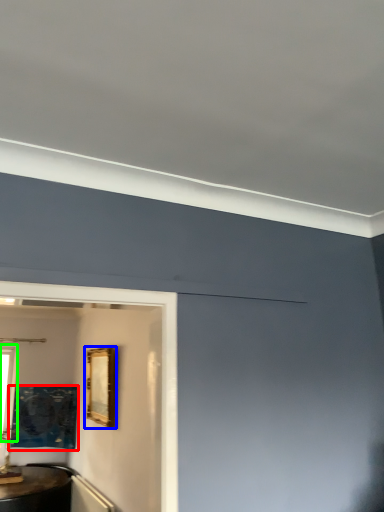
Question: Considering the real-world distances, which object is closest to picture frame (highlighted by a red box)? picture frame (highlighted by a blue box) or window (highlighted by a green box).

Choices:
 (A) picture frame
 (B) window

Answer: (B)